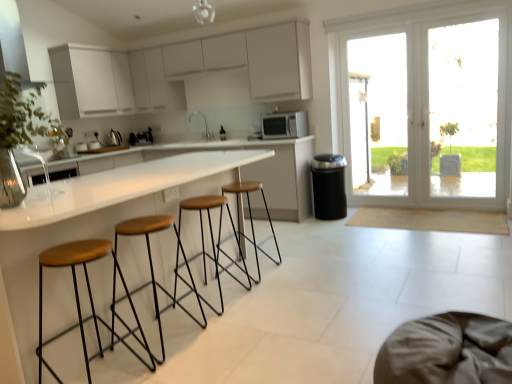
I want to click on free spot to the left of brown fabric swivel chair at lower right, so click(x=289, y=358).